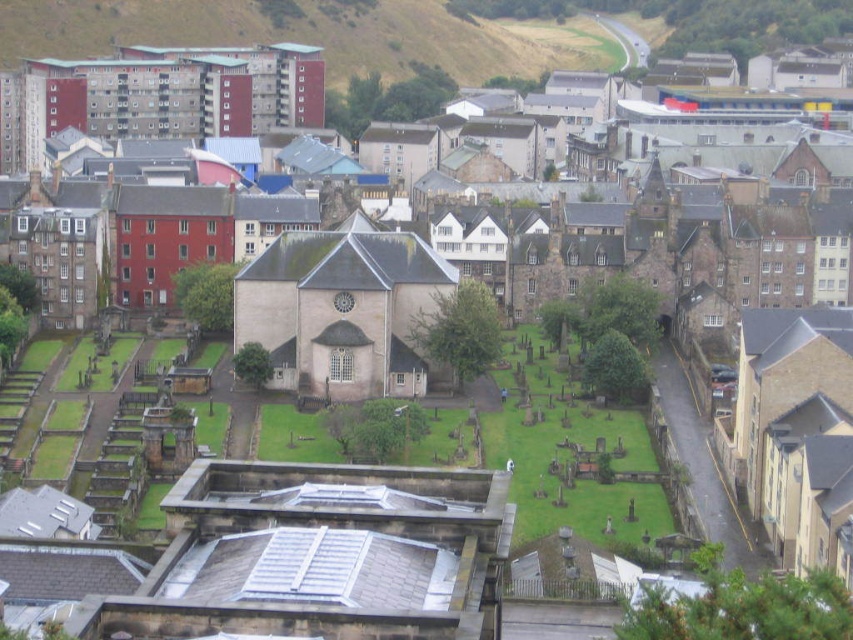
You are a drone operator flying over a historic Scottish town and need to locate the smooth stone church at center. According to the coordinates provided, where would you position the drone to capture the church in the center of your camera frame?

The smooth stone church at center is located at point [341,310], so positioning the drone at those coordinates would center the church in the camera frame.

You are a tourist standing at the edge of the churchyard and want to take a photo of both the smooth stone church at center and the matte brick church at upper left. Which church should you position yourself closer to in order to capture both in the same frame?

You should position yourself closer to the smooth stone church at center because it is shorter than the matte brick church at upper left, allowing both to be captured in the same frame when closer to the shorter one.

You are standing at the entrance of the matte brick church at upper left and want to visit the smooth stone church at center. In which direction should you walk to reach it?

You should walk to your right because the smooth stone church at center is located to the right of the matte brick church at upper left.